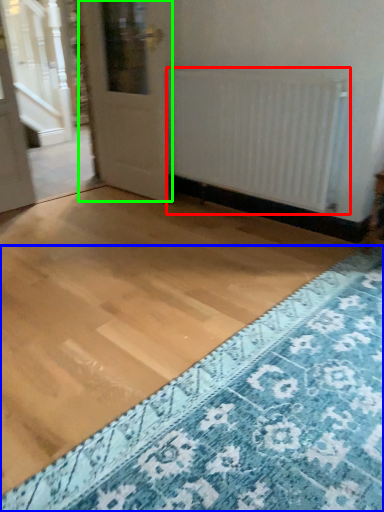
Question: Considering the real-world distances, which object is farthest from radiator (highlighted by a red box)? doormat (highlighted by a blue box) or door (highlighted by a green box)?

Choices:
 (A) doormat
 (B) door

Answer: (A)